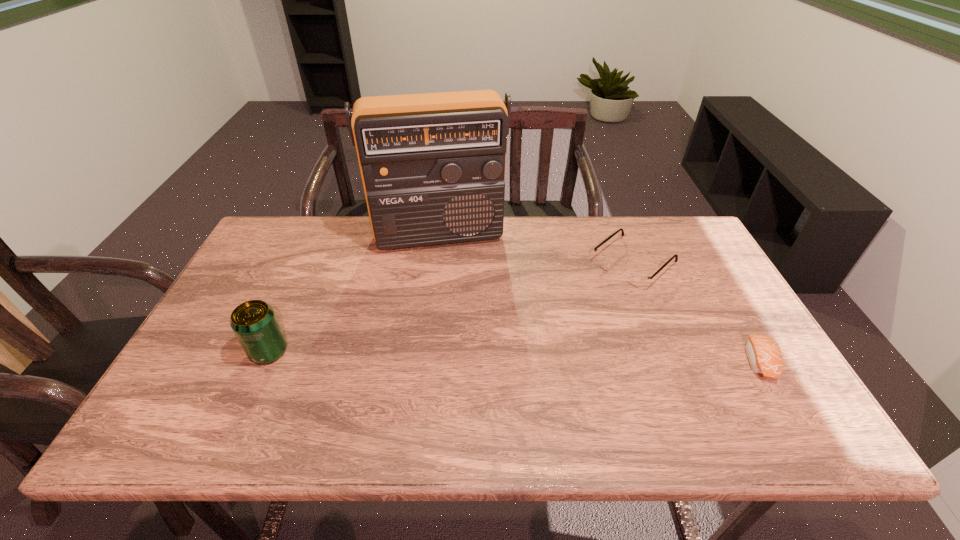
Locate an element on the screen. free space located at the hinge ends of the spectacles is located at coordinates (599, 294).

At what (x,y) coordinates should I click in order to perform the action: click on vacant area situated at the hinge ends of the spectacles. Please return your answer as a coordinate pair (x, y). This screenshot has width=960, height=540. Looking at the image, I should click on (553, 334).

The image size is (960, 540). In order to click on vacant position located 0.120m at the hinge ends of the spectacles in this screenshot , I will do `click(585, 306)`.

The image size is (960, 540). In order to click on blank area located 0.110m on the front-facing side of the radio receiver in this screenshot , I will do `click(452, 278)`.

Locate an element on the screen. This screenshot has height=540, width=960. vacant space positioned on the front-facing side of the radio receiver is located at coordinates (460, 323).

You are a GUI agent. You are given a task and a screenshot of the screen. Output one action in this format:
    pyautogui.click(x=<x>, y=<y>)
    Task: Click on the vacant space located 0.070m on the front-facing side of the radio receiver
    This screenshot has width=960, height=540.
    Given the screenshot: What is the action you would take?
    pyautogui.click(x=450, y=269)

Image resolution: width=960 pixels, height=540 pixels. In order to click on spectacles at the far edge in this screenshot , I will do `click(635, 278)`.

I want to click on radio receiver at the far edge, so click(x=432, y=165).

Locate an element on the screen. This screenshot has height=540, width=960. object that is at the near edge is located at coordinates (764, 354).

The height and width of the screenshot is (540, 960). What are the coordinates of `object at the left edge` in the screenshot? It's located at (254, 322).